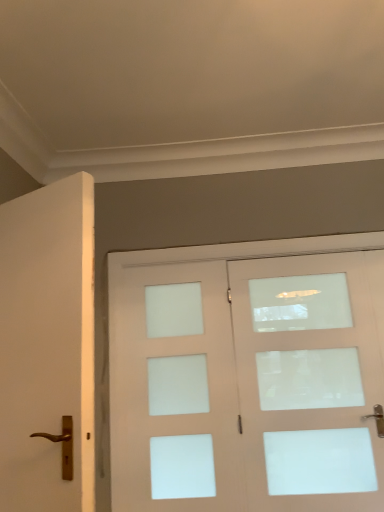
Identify the location of matte white door at center, which is counted as the 1th door, starting from the right. This screenshot has height=512, width=384. (245, 378).

Where is `white frosted glass screen door at center`? white frosted glass screen door at center is located at coordinates (172, 385).

Can we say white frosted glass screen door at center lies outside white matte door at left, which ranks as the second door in back-to-front order?

white frosted glass screen door at center is positioned outside white matte door at left, which ranks as the second door in back-to-front order.

Between white frosted glass screen door at center and white matte door at left, acting as the first door starting from the front, which one appears on the left side from the viewer's perspective?

From the viewer's perspective, white matte door at left, acting as the first door starting from the front, appears more on the left side.

Which of these two, white frosted glass screen door at center or white matte door at left, which ranks as the second door in back-to-front order, is smaller?

Smaller between the two is white frosted glass screen door at center.

Considering the relative sizes of white frosted glass screen door at center and white matte door at left, acting as the first door starting from the front, in the image provided, is white frosted glass screen door at center taller than white matte door at left, acting as the first door starting from the front,?

Yes, white frosted glass screen door at center is taller than white matte door at left, acting as the first door starting from the front.

How different are the orientations of white matte door at left, acting as the first door starting from the front, and matte white door at center, acting as the first door starting from the back, in degrees?

They differ by 151 degrees in their facing directions.

Between point (60, 379) and point (180, 337), which one is positioned behind?

The point (180, 337) is behind.

Can you confirm if white matte door at left, which is the second door in right-to-left order, is smaller than matte white door at center, the 2th door positioned from the left?

Correct, white matte door at left, which is the second door in right-to-left order, occupies less space than matte white door at center, the 2th door positioned from the left.

Can you confirm if white matte door at left, acting as the first door starting from the front, is thinner than matte white door at center, which is counted as the 1th door, starting from the right?

In fact, white matte door at left, acting as the first door starting from the front, might be wider than matte white door at center, which is counted as the 1th door, starting from the right.

Could you tell me if matte white door at center, which is the second door from front to back, is facing white matte door at left, which is the second door in right-to-left order?

No.

You are a GUI agent. You are given a task and a screenshot of the screen. Output one action in this format:
    pyautogui.click(x=<x>, y=<y>)
    Task: Click on the door located in front of the matte white door at center, acting as the first door starting from the back
    
    Given the screenshot: What is the action you would take?
    pyautogui.click(x=47, y=345)

Is the position of matte white door at center, acting as the first door starting from the back, less distant than that of white matte door at left, which is the second door in right-to-left order?

No, it is behind white matte door at left, which is the second door in right-to-left order.

From the image's perspective, is matte white door at center, acting as the first door starting from the back, located above or below white matte door at left, acting as the first door starting from the front?

Based on their image positions, matte white door at center, acting as the first door starting from the back, is located beneath white matte door at left, acting as the first door starting from the front.

Would you say white matte door at left, which ranks as the second door in back-to-front order, is outside white frosted glass screen door at center?

Yes, white matte door at left, which ranks as the second door in back-to-front order, is outside of white frosted glass screen door at center.

You are a GUI agent. You are given a task and a screenshot of the screen. Output one action in this format:
    pyautogui.click(x=<x>, y=<y>)
    Task: Click on the door that is the 2nd one when counting forward from the white frosted glass screen door at center
    The width and height of the screenshot is (384, 512).
    Given the screenshot: What is the action you would take?
    point(47,345)

From the image's perspective, between white matte door at left, which is the second door in right-to-left order, and white frosted glass screen door at center, which one is located above?

From the image's view, white matte door at left, which is the second door in right-to-left order, is above.

How distant is white frosted glass screen door at center from matte white door at center, the 2th door positioned from the left?

A distance of 5.53 inches exists between white frosted glass screen door at center and matte white door at center, the 2th door positioned from the left.

Is white frosted glass screen door at center shorter than matte white door at center, which is counted as the 1th door, starting from the right?

Yes, white frosted glass screen door at center is shorter than matte white door at center, which is counted as the 1th door, starting from the right.

Find the location of `door that is the 1st one when counting forward from the white frosted glass screen door at center`. door that is the 1st one when counting forward from the white frosted glass screen door at center is located at coordinates (245, 378).

Is white frosted glass screen door at center with matte white door at center, the 2th door positioned from the left?

No.

Which of these two, matte white door at center, acting as the first door starting from the back, or white frosted glass screen door at center, stands taller?

matte white door at center, acting as the first door starting from the back.

Does matte white door at center, which is counted as the 1th door, starting from the right, appear on the left side of white frosted glass screen door at center?

No.

Is matte white door at center, which is the second door from front to back, not within white frosted glass screen door at center?

Yes, matte white door at center, which is the second door from front to back, is outside of white frosted glass screen door at center.

The height and width of the screenshot is (512, 384). Identify the location of screen door below the white matte door at left, arranged as the first door when viewed from the left (from the image's perspective). (172, 385).

This screenshot has height=512, width=384. Find the location of `door that is above the matte white door at center, which is the second door from front to back (from the image's perspective)`. door that is above the matte white door at center, which is the second door from front to back (from the image's perspective) is located at coordinates (47, 345).

From the image, which object appears to be nearer to white frosted glass screen door at center, matte white door at center, which is counted as the 1th door, starting from the right, or white matte door at left, which ranks as the second door in back-to-front order?

matte white door at center, which is counted as the 1th door, starting from the right.

Estimate the real-world distances between objects in this image. Which object is closer to matte white door at center, which is the second door from front to back, white frosted glass screen door at center or white matte door at left, arranged as the first door when viewed from the left?

white frosted glass screen door at center is positioned closer to the anchor matte white door at center, which is the second door from front to back.

Based on their spatial positions, is white matte door at left, arranged as the first door when viewed from the left, or white frosted glass screen door at center further from matte white door at center, the 2th door positioned from the left?

Among the two, white matte door at left, arranged as the first door when viewed from the left, is located further to matte white door at center, the 2th door positioned from the left.

Estimate the real-world distances between objects in this image. Which object is further from white matte door at left, which is the second door in right-to-left order, matte white door at center, acting as the first door starting from the back, or white frosted glass screen door at center?

Based on the image, matte white door at center, acting as the first door starting from the back, appears to be further to white matte door at left, which is the second door in right-to-left order.

Considering their positions, is white frosted glass screen door at center positioned closer to white matte door at left, which ranks as the second door in back-to-front order, than matte white door at center, the 2th door positioned from the left?

Based on the image, white frosted glass screen door at center appears to be nearer to white matte door at left, which ranks as the second door in back-to-front order.

Estimate the real-world distances between objects in this image. Which object is closer to white frosted glass screen door at center, white matte door at left, acting as the first door starting from the front, or matte white door at center, acting as the first door starting from the back?

matte white door at center, acting as the first door starting from the back, is positioned closer to the anchor white frosted glass screen door at center.

The image size is (384, 512). I want to click on door located between white matte door at left, which ranks as the second door in back-to-front order, and white frosted glass screen door at center in the depth direction, so click(245, 378).